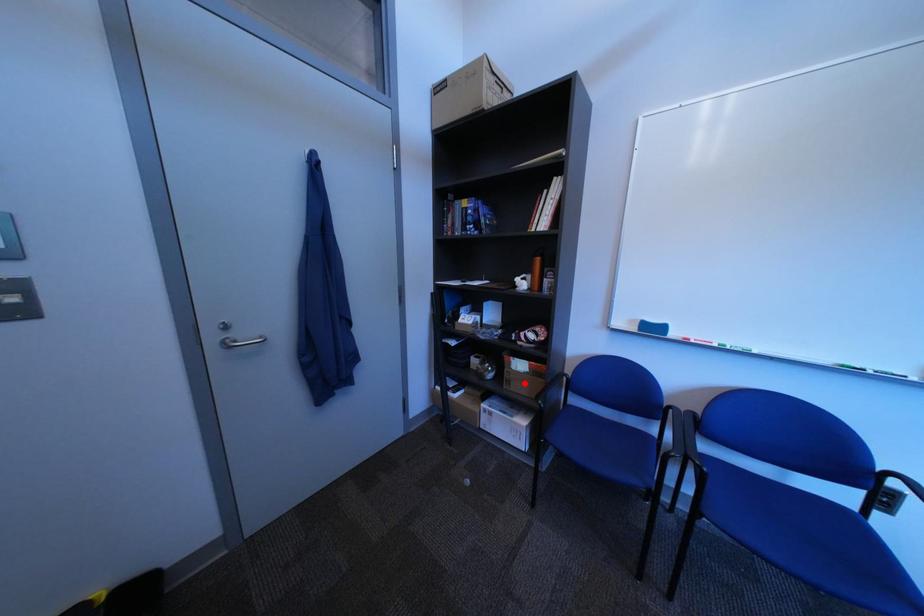
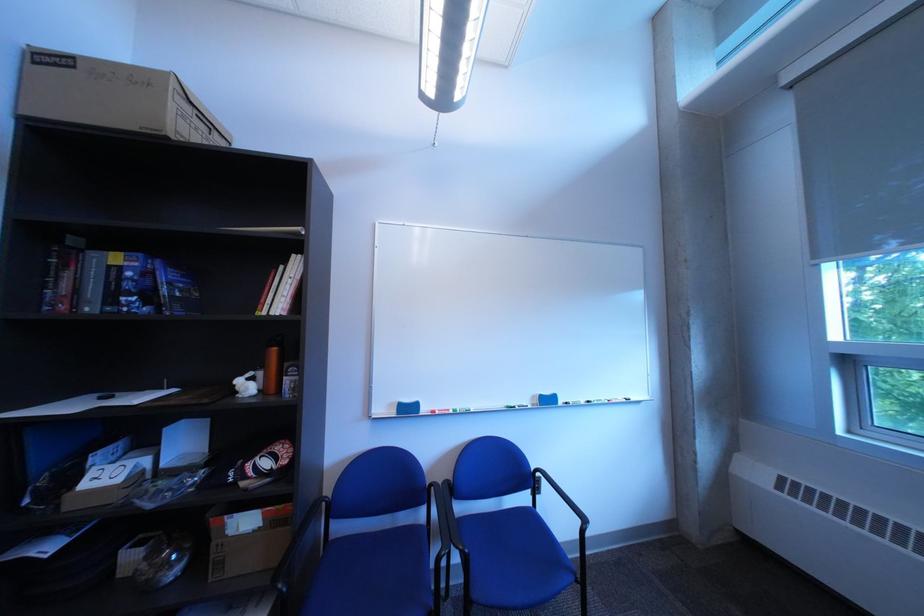
Question: A red point is marked in image1. In image2, is the corresponding 3D point closer to the camera or farther? Reply with the corresponding letter.

Choices:
 (A) The corresponding 3D point is closer.
 (B) The corresponding 3D point is farther.

Answer: (A)